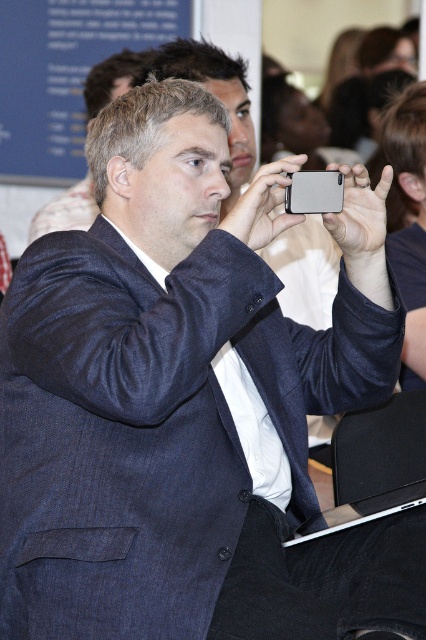
Who is positioned more to the left, dark blue textured suit at center or dark blue suit at center?

From the viewer's perspective, dark blue suit at center appears more on the left side.

Consider the image. How far apart are dark blue textured suit at center and dark blue suit at center?

dark blue textured suit at center and dark blue suit at center are 5.52 feet apart.

Who is more forward, (92, 262) or (104, 93)?

Positioned in front is point (92, 262).

What are the coordinates of `dark blue textured suit at center` in the screenshot? It's located at (154, 428).